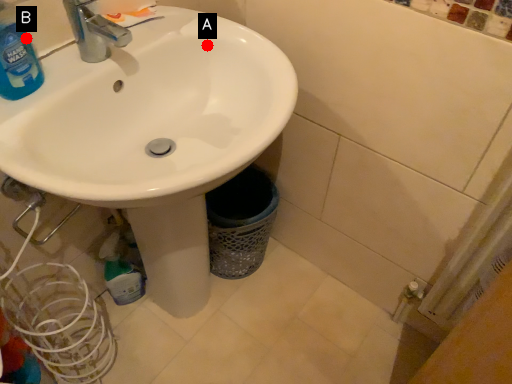
Question: Two points are circled on the image, labeled by A and B beside each circle. Among these points, which one is nearest to the camera?

Choices:
 (A) A is closer
 (B) B is closer

Answer: (B)